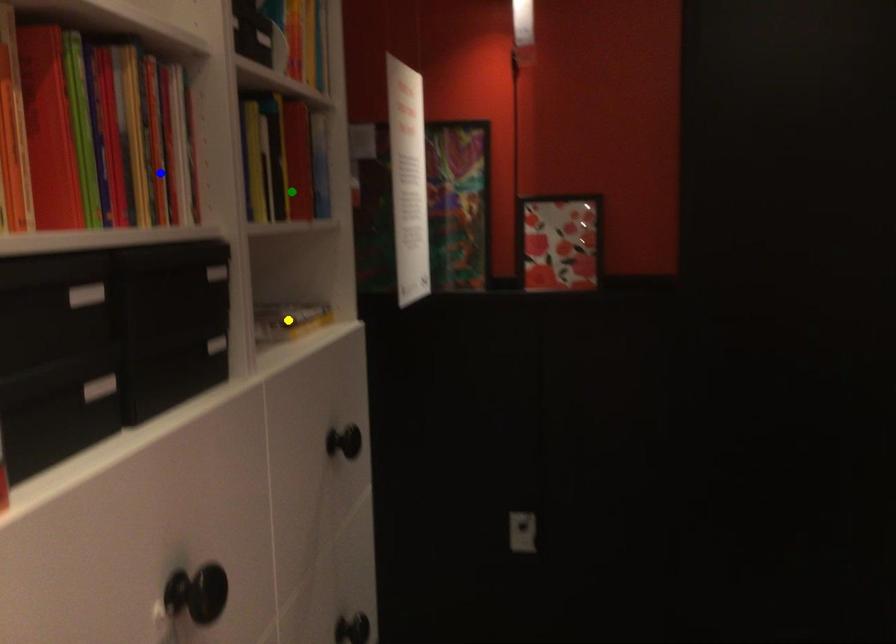
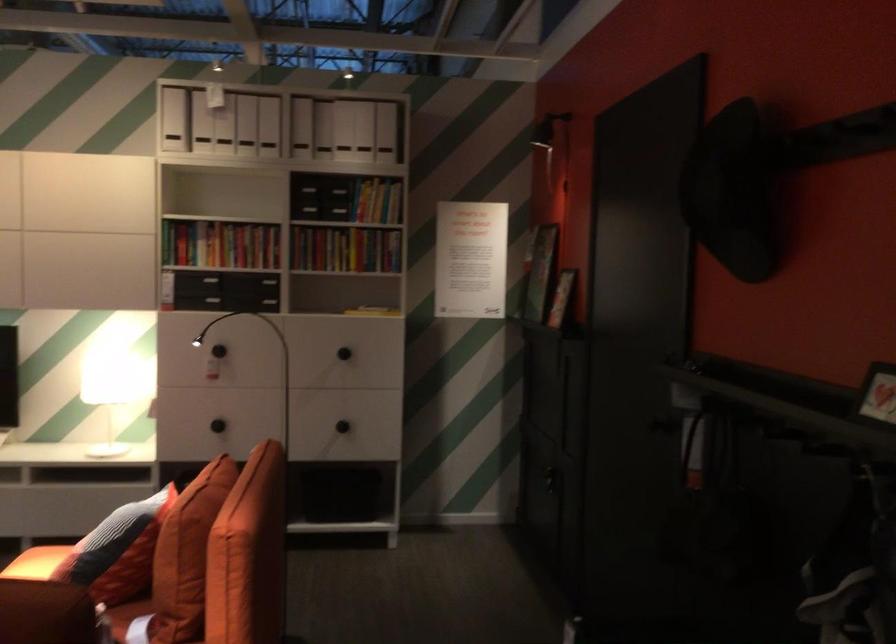
I am providing you with two images of the same scene from different viewpoints. Three points are marked in image1. Which point corresponds to a part or object that is occluded in image2?In image1, three points are marked. Which of them correspond to a part or object that is occluded in image2?Among the three points shown in image1, which one corresponds to a part or object that is no longer visible due to occlusion in image2?

Invisible in image2: yellow point.